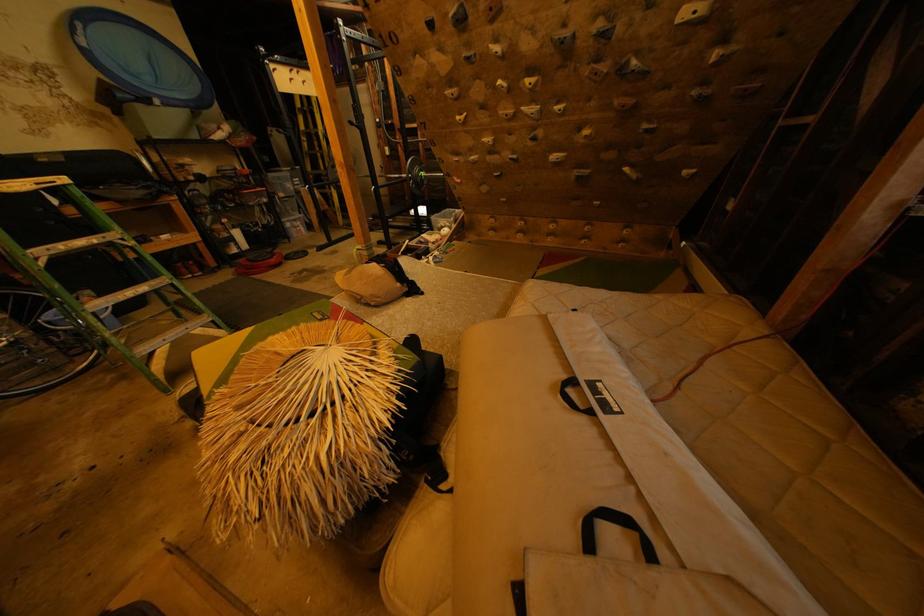
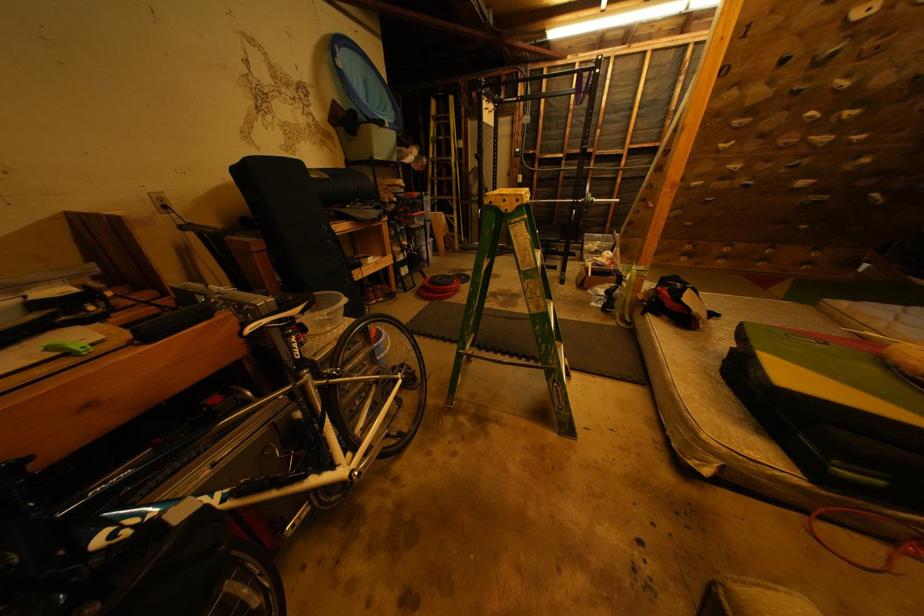
Question: What movement of the cameraman would produce the second image?

Choices:
 (A) Left
 (B) Right
 (C) Forward
 (D) Backward

Answer: (A)